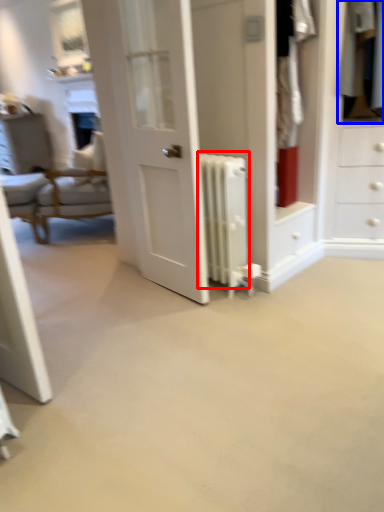
Question: Which point is closer to the camera, radiator (highlighted by a red box) or clothing (highlighted by a blue box)?

Choices:
 (A) radiator
 (B) clothing

Answer: (A)